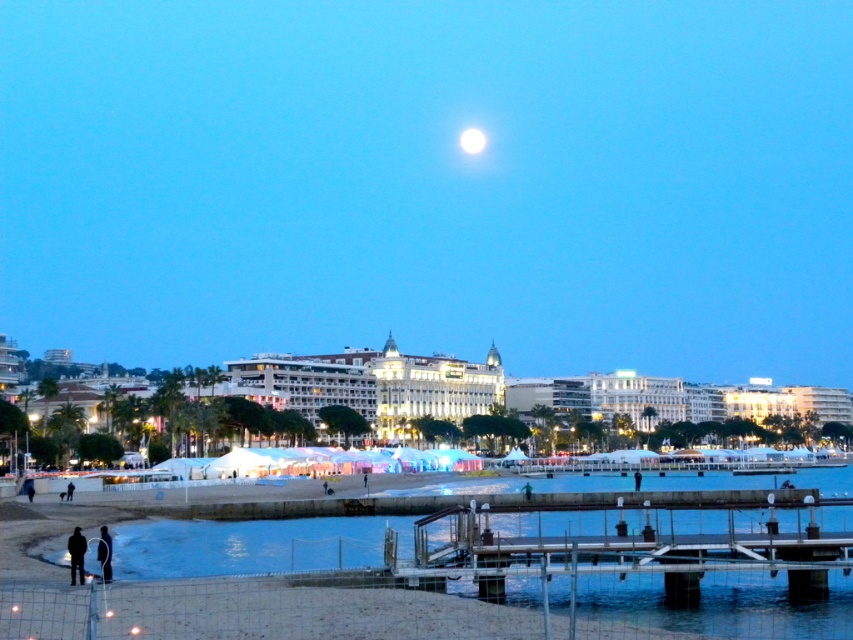
Which of these two, dark clothing figure at lower left or bright white orb at upper center, stands shorter?

dark clothing figure at lower left

Identify the location of dark clothing figure at lower left. The width and height of the screenshot is (853, 640). (76, 554).

Does point (74, 525) lie in front of point (479, 132)?

That is True.

Find the location of a particular element. dark clothing figure at lower left is located at coordinates (76, 554).

You are a GUI agent. You are given a task and a screenshot of the screen. Output one action in this format:
    pyautogui.click(x=<x>, y=<y>)
    Task: Click on the metallic gray dock at lower center
    This screenshot has height=640, width=853.
    Given the screenshot: What is the action you would take?
    pyautogui.click(x=621, y=547)

Does metallic gray dock at lower center have a smaller size compared to dark clothing figure at lower left?

No.

Identify the location of metallic gray dock at lower center. (621, 547).

Is point (83, 548) farther from camera compared to point (109, 548)?

No, it is not.

Does dark clothing figure at lower left appear on the left side of black matte person at lower left?

Correct, you'll find dark clothing figure at lower left to the left of black matte person at lower left.

Which is in front, point (78, 554) or point (106, 525)?

Point (78, 554) is in front.

This screenshot has width=853, height=640. In order to click on dark clothing figure at lower left in this screenshot , I will do `click(76, 554)`.